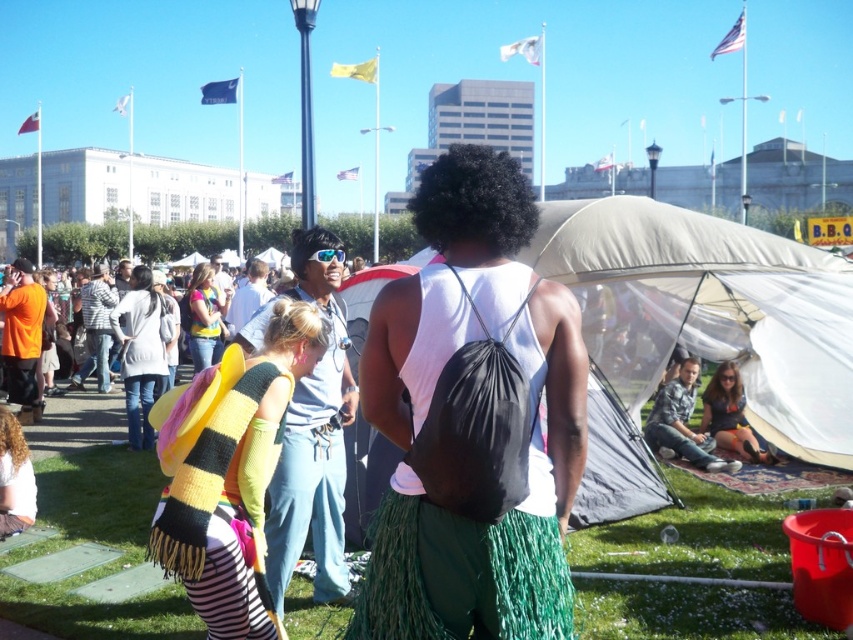
Question: Which point appears closest to the camera in this image?

Choices:
 (A) (326, 257)
 (B) (175, 548)
 (C) (737, 416)
 (D) (515, 224)

Answer: (D)

Question: Which of the following is the farthest from the observer?

Choices:
 (A) knitted scarf at center
 (B) black matte backpack at center
 (C) multicolored knit scarf at center

Answer: (C)

Question: Where is green fringed skirt at lower center located in relation to multicolored knit scarf at center in the image?

Choices:
 (A) right
 (B) left

Answer: (A)

Question: Among these objects, which one is nearest to the camera?

Choices:
 (A) green fringed skirt at lower center
 (B) knitted scarf at lower left

Answer: (A)

Question: Can you confirm if knitted scarf at lower left is bigger than black matte afro at center?

Choices:
 (A) yes
 (B) no

Answer: (B)

Question: Can you confirm if black curly hair at center is smaller than blonde hair at center?

Choices:
 (A) yes
 (B) no

Answer: (B)